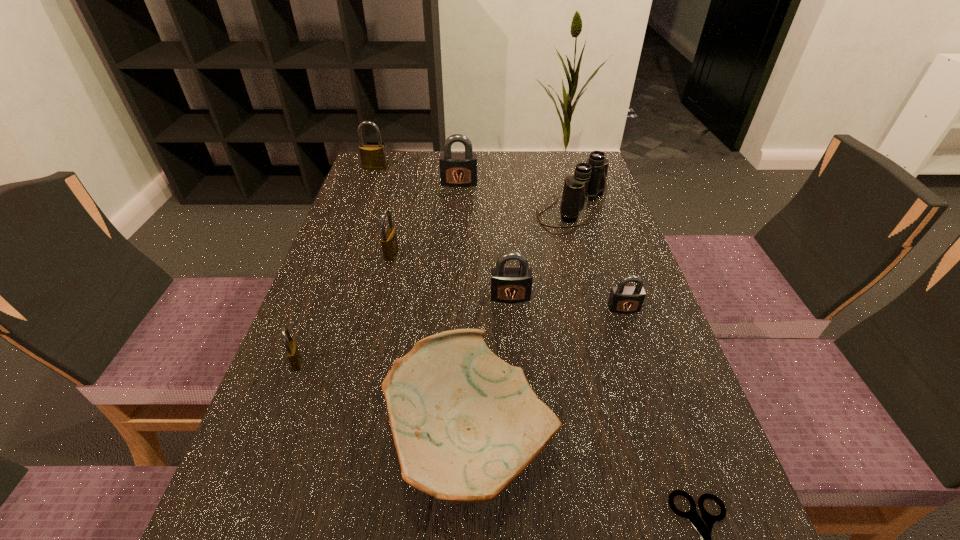
Where is `vacant space situated 0.320m on the back of the smallest brass padlock`? This screenshot has width=960, height=540. vacant space situated 0.320m on the back of the smallest brass padlock is located at coordinates (x=340, y=247).

Find the location of a particular element. Image resolution: width=960 pixels, height=540 pixels. free space located 0.140m on the front of the smallest gray padlock near the keyhole is located at coordinates (644, 370).

Image resolution: width=960 pixels, height=540 pixels. Identify the location of binoculars positioned at the far edge. (589, 180).

The height and width of the screenshot is (540, 960). I want to click on binoculars positioned at the right edge, so click(589, 180).

The width and height of the screenshot is (960, 540). I want to click on padlock present at the right edge, so click(x=623, y=299).

Where is `object at the far left corner`? The image size is (960, 540). object at the far left corner is located at coordinates (372, 156).

This screenshot has width=960, height=540. I want to click on object at the far right corner, so click(x=589, y=180).

Where is `vacant space at the far edge`? The image size is (960, 540). vacant space at the far edge is located at coordinates (433, 164).

Find the location of a particular element. vacant space at the left edge of the desktop is located at coordinates (285, 428).

Find the location of a particular element. vacant area at the right edge of the desktop is located at coordinates (614, 252).